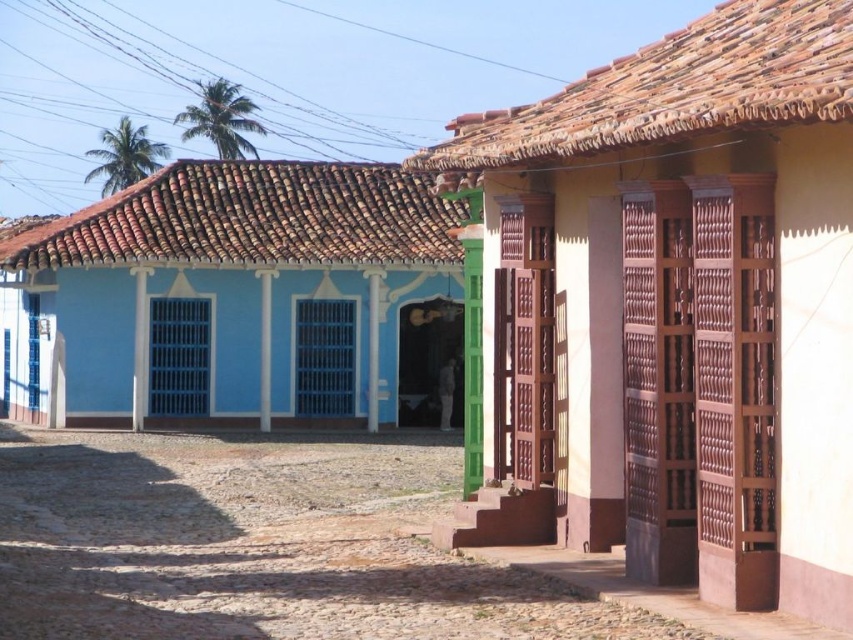
Question: Can you confirm if matte brown wooden door at center is bigger than blue painted wood house at left?

Choices:
 (A) yes
 (B) no

Answer: (B)

Question: Does matte brown wooden door at center appear over blue painted wood house at left?

Choices:
 (A) no
 (B) yes

Answer: (A)

Question: Can you confirm if matte brown wooden door at center is bigger than blue painted wood house at left?

Choices:
 (A) no
 (B) yes

Answer: (A)

Question: Which point is farther from the camera taking this photo?

Choices:
 (A) (299, 412)
 (B) (621, 276)

Answer: (A)

Question: Which point is farther to the camera?

Choices:
 (A) (711, 349)
 (B) (175, 305)

Answer: (B)